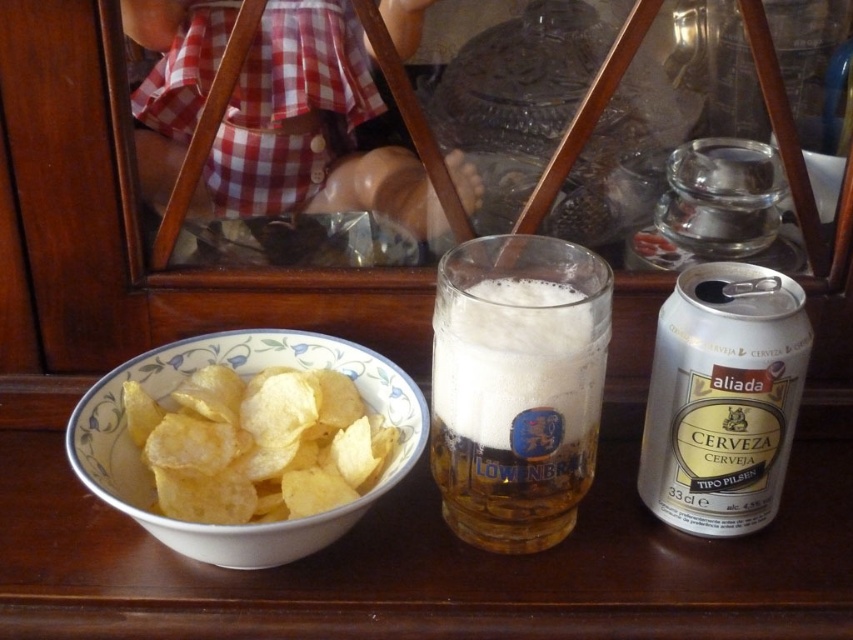
Is point (440, 394) behind point (753, 355)?

That is True.

Which of these two, foamy glass beer at center or silver metallic can at right, stands shorter?

Standing shorter between the two is foamy glass beer at center.

Image resolution: width=853 pixels, height=640 pixels. Describe the element at coordinates (515, 406) in the screenshot. I see `foamy glass beer at center` at that location.

Locate an element on the screen. The image size is (853, 640). foamy glass beer at center is located at coordinates (515, 406).

Does silver metallic can at right appear on the right side of golden crispy chips at left?

Yes, silver metallic can at right is to the right of golden crispy chips at left.

Can you confirm if silver metallic can at right is positioned above golden crispy chips at left?

Correct, silver metallic can at right is located above golden crispy chips at left.

Is point (685, 292) behind point (363, 486)?

That is False.

The height and width of the screenshot is (640, 853). What are the coordinates of `silver metallic can at right` in the screenshot? It's located at (723, 397).

Who is more distant from viewer, (469,404) or (201,416)?

The point (201,416) is behind.

In the scene shown: Which is more to the left, foamy glass beer at center or golden crispy chips at left?

golden crispy chips at left

Is point (558, 464) closer to viewer compared to point (222, 451)?

Yes, point (558, 464) is in front of point (222, 451).

Locate an element on the screen. The width and height of the screenshot is (853, 640). foamy glass beer at center is located at coordinates (515, 406).